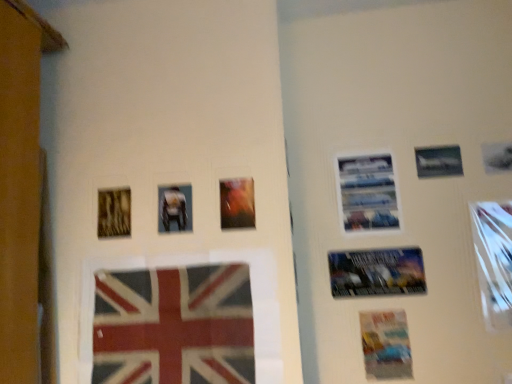
How much space does wooden textured frame at left, arranged as the 6th picture frame when viewed from the right, occupy vertically?

The height of wooden textured frame at left, arranged as the 6th picture frame when viewed from the right, is 6.43 inches.

Describe the element at coordinates (377, 272) in the screenshot. This screenshot has width=512, height=384. I see `metallic silver poster at center right, the 2th poster when ordered from bottom to top` at that location.

Locate an element on the screen. matte paper poster at lower right, the first poster when ordered from bottom to top is located at coordinates (386, 345).

Which is correct: metallic silver airplane at upper right, acting as the 4th picture frame starting from the left, is inside matte plastic picture frame at center, which is the fourth picture frame in right-to-left order, or outside of it?

metallic silver airplane at upper right, acting as the 4th picture frame starting from the left, lies outside matte plastic picture frame at center, which is the fourth picture frame in right-to-left order.

Locate an element on the screen. picture frame that is the 4th one below the metallic silver airplane at upper right, acting as the 4th picture frame starting from the left (from a real-world perspective) is located at coordinates (237, 203).

What's the angular difference between metallic silver airplane at upper right, marked as the 3th picture frame in a right-to-left arrangement, and matte plastic picture frame at center, which is the fourth picture frame in right-to-left order,'s facing directions?

0.828 degrees separate the facing orientations of metallic silver airplane at upper right, marked as the 3th picture frame in a right-to-left arrangement, and matte plastic picture frame at center, which is the fourth picture frame in right-to-left order.

Considering the relative positions of metallic silver airplane at upper right, acting as the 4th picture frame starting from the left, and matte plastic picture frame at center, the third picture frame viewed from the left, in the image provided, is metallic silver airplane at upper right, acting as the 4th picture frame starting from the left, to the right of matte plastic picture frame at center, the third picture frame viewed from the left, from the viewer's perspective?

Yes, metallic silver airplane at upper right, acting as the 4th picture frame starting from the left, is to the right of matte plastic picture frame at center, the third picture frame viewed from the left.

Is matte paper poster at lower right, marked as the third poster in a top-to-bottom arrangement, positioned beyond the bounds of matte plastic photo frame at center, which is the 5th picture frame in right-to-left order?

Yes, matte paper poster at lower right, marked as the third poster in a top-to-bottom arrangement, is located beyond the bounds of matte plastic photo frame at center, which is the 5th picture frame in right-to-left order.

You are a GUI agent. You are given a task and a screenshot of the screen. Output one action in this format:
    pyautogui.click(x=<x>, y=<y>)
    Task: Click on the 2nd poster positioned below the matte plastic photo frame at center, which is the 5th picture frame in right-to-left order (from a real-world perspective)
    This screenshot has width=512, height=384.
    Given the screenshot: What is the action you would take?
    pyautogui.click(x=386, y=345)

What's the angular difference between matte paper poster at lower right, the first poster when ordered from bottom to top, and matte plastic photo frame at center, which is the second picture frame in left-to-right order,'s facing directions?

1.34 degrees.

From the image's perspective, would you say matte paper poster at lower right, the first poster when ordered from bottom to top, is shown under matte plastic photo frame at center, which is the 5th picture frame in right-to-left order?

Yes, from the image's perspective, matte paper poster at lower right, the first poster when ordered from bottom to top, is beneath matte plastic photo frame at center, which is the 5th picture frame in right-to-left order.

Is textured fabric flag at lower center positioned with its back to metallic silver poster at upper right, the first poster positioned from the top?

No, metallic silver poster at upper right, the first poster positioned from the top, is not at the back of textured fabric flag at lower center.

From a real-world perspective, which object stands above the other?

metallic silver poster at upper right, the first poster positioned from the top.

From the picture: Can you tell me how much textured fabric flag at lower center and metallic silver poster at upper right, the first poster positioned from the top, differ in facing direction?

0.677 degrees separate the facing orientations of textured fabric flag at lower center and metallic silver poster at upper right, the first poster positioned from the top.

Is textured fabric flag at lower center to the right of metallic silver poster at upper right, marked as the third poster in a bottom-to-top arrangement, from the viewer's perspective?

In fact, textured fabric flag at lower center is to the left of metallic silver poster at upper right, marked as the third poster in a bottom-to-top arrangement.

Can you confirm if metallic silver poster at upper right, marked as the third poster in a bottom-to-top arrangement, is taller than textured fabric flag at lower center?

In fact, metallic silver poster at upper right, marked as the third poster in a bottom-to-top arrangement, may be shorter than textured fabric flag at lower center.

Consider the image. Can you confirm if metallic silver poster at upper right, the first poster positioned from the top, is smaller than textured fabric flag at lower center?

Yes, metallic silver poster at upper right, the first poster positioned from the top, is smaller than textured fabric flag at lower center.

Which is more distant, (375,174) or (217,320)?

Point (375,174)

In the image, is metallic silver poster at upper right, marked as the third poster in a bottom-to-top arrangement, on the left side or the right side of textured fabric flag at lower center?

Clearly, metallic silver poster at upper right, marked as the third poster in a bottom-to-top arrangement, is on the right of textured fabric flag at lower center in the image.

Based on the photo, could you tell me if metallic silver picture frame at right, placed as the first picture frame when sorted from right to left, is facing matte paper poster at lower right, marked as the third poster in a top-to-bottom arrangement?

No, metallic silver picture frame at right, placed as the first picture frame when sorted from right to left, is not aimed at matte paper poster at lower right, marked as the third poster in a top-to-bottom arrangement.

There is a metallic silver picture frame at right, placed as the first picture frame when sorted from right to left. At what (x,y) coordinates should I click in order to perform the action: click on the 2nd poster below it (from the image's perspective). Please return your answer as a coordinate pair (x, y). The width and height of the screenshot is (512, 384). Looking at the image, I should click on (386, 345).

From the image's perspective, which object appears higher, metallic silver picture frame at right, which appears as the sixth picture frame when viewed from the left, or matte paper poster at lower right, marked as the third poster in a top-to-bottom arrangement?

metallic silver picture frame at right, which appears as the sixth picture frame when viewed from the left, from the image's perspective.

From a real-world perspective, which is physically below, metallic silver picture frame at right, which appears as the sixth picture frame when viewed from the left, or matte paper poster at lower right, the first poster when ordered from bottom to top?

matte paper poster at lower right, the first poster when ordered from bottom to top, from a real-world perspective.

Is metallic silver poster at center right, which appears as the 2th poster when viewed from the top, thinner than metallic silver poster at upper right, marked as the third poster in a bottom-to-top arrangement?

No, metallic silver poster at center right, which appears as the 2th poster when viewed from the top, is not thinner than metallic silver poster at upper right, marked as the third poster in a bottom-to-top arrangement.

From the image's perspective, is metallic silver poster at center right, the 2th poster when ordered from bottom to top, below metallic silver poster at upper right, marked as the third poster in a bottom-to-top arrangement?

Indeed, from the image's perspective, metallic silver poster at center right, the 2th poster when ordered from bottom to top, is shown beneath metallic silver poster at upper right, marked as the third poster in a bottom-to-top arrangement.

Considering their positions, is metallic silver poster at center right, the 2th poster when ordered from bottom to top, located in front of or behind metallic silver poster at upper right, marked as the third poster in a bottom-to-top arrangement?

metallic silver poster at center right, the 2th poster when ordered from bottom to top, is positioned closer to the viewer than metallic silver poster at upper right, marked as the third poster in a bottom-to-top arrangement.

Is point (415, 258) positioned before point (350, 174)?

Yes, it is in front of point (350, 174).

From the picture: From the image's perspective, is textured fabric flag at lower center positioned above or below wooden textured frame at left, marked as the first picture frame in a left-to-right arrangement?

Based on their image positions, textured fabric flag at lower center is located beneath wooden textured frame at left, marked as the first picture frame in a left-to-right arrangement.

Consider the image. Which object is closer to the camera taking this photo, textured fabric flag at lower center or wooden textured frame at left, arranged as the 6th picture frame when viewed from the right?

textured fabric flag at lower center is in front.

Is textured fabric flag at lower center turned away from wooden textured frame at left, arranged as the 6th picture frame when viewed from the right?

No.

From the image's perspective, which picture frame is the 1st one below the metallic silver airplane at upper right, acting as the 4th picture frame starting from the left? Please provide its 2D coordinates.

[(237, 203)]

Locate an element on the screen. This screenshot has height=384, width=512. the 1st poster behind the matte plastic photo frame at center, which is the 5th picture frame in right-to-left order, starting your count from the anchor is located at coordinates (386, 345).

Estimate the real-world distances between objects in this image. Which object is closer to metallic silver airplane at upper right, positioned as the 5th picture frame in left-to-right order, matte plastic picture frame at center, which is the fourth picture frame in right-to-left order, or metallic silver poster at center right, which appears as the 2th poster when viewed from the top?

Among the two, metallic silver poster at center right, which appears as the 2th poster when viewed from the top, is located nearer to metallic silver airplane at upper right, positioned as the 5th picture frame in left-to-right order.

Considering their positions, is matte plastic picture frame at center, the third picture frame viewed from the left, positioned further to metallic silver picture frame at right, placed as the first picture frame when sorted from right to left, than metallic silver poster at upper right, marked as the third poster in a bottom-to-top arrangement?

matte plastic picture frame at center, the third picture frame viewed from the left, is further to metallic silver picture frame at right, placed as the first picture frame when sorted from right to left.

Based on their spatial positions, is matte plastic photo frame at center, which is the second picture frame in left-to-right order, or wooden textured frame at left, marked as the first picture frame in a left-to-right arrangement, further from metallic silver poster at upper right, the first poster positioned from the top?

wooden textured frame at left, marked as the first picture frame in a left-to-right arrangement, lies further to metallic silver poster at upper right, the first poster positioned from the top, than the other object.

Looking at the image, which one is located closer to metallic silver poster at center right, which appears as the 2th poster when viewed from the top, matte paper poster at lower right, the first poster when ordered from bottom to top, or matte plastic picture frame at center, which is the fourth picture frame in right-to-left order?

Based on the image, matte paper poster at lower right, the first poster when ordered from bottom to top, appears to be nearer to metallic silver poster at center right, which appears as the 2th poster when viewed from the top.

Looking at this image, from the image, which object appears to be nearer to metallic silver airplane at upper right, marked as the 3th picture frame in a right-to-left arrangement, metallic silver picture frame at right, which appears as the sixth picture frame when viewed from the left, or metallic silver poster at center right, the 2th poster when ordered from bottom to top?

The object closer to metallic silver airplane at upper right, marked as the 3th picture frame in a right-to-left arrangement, is metallic silver picture frame at right, which appears as the sixth picture frame when viewed from the left.

Which object lies further to the anchor point textured fabric flag at lower center, matte paper poster at lower right, the first poster when ordered from bottom to top, or wooden textured frame at left, marked as the first picture frame in a left-to-right arrangement?

matte paper poster at lower right, the first poster when ordered from bottom to top.

Which object lies further to the anchor point matte paper poster at lower right, marked as the third poster in a top-to-bottom arrangement, matte plastic photo frame at center, which is the second picture frame in left-to-right order, or textured fabric flag at lower center?

Based on the image, matte plastic photo frame at center, which is the second picture frame in left-to-right order, appears to be further to matte paper poster at lower right, marked as the third poster in a top-to-bottom arrangement.

Estimate the real-world distances between objects in this image. Which object is closer to matte plastic picture frame at center, the third picture frame viewed from the left, metallic silver poster at upper right, marked as the third poster in a bottom-to-top arrangement, or textured fabric flag at lower center?

textured fabric flag at lower center lies closer to matte plastic picture frame at center, the third picture frame viewed from the left, than the other object.

At what (x,y) coordinates should I click in order to perform the action: click on picture frame between metallic silver poster at upper right, the first poster positioned from the top, and metallic silver airplane at upper right, acting as the 2th picture frame starting from the right, in the horizontal direction. Please return your answer as a coordinate pair (x, y). The width and height of the screenshot is (512, 384). Looking at the image, I should click on (438, 161).

This screenshot has height=384, width=512. What are the coordinates of `flag located between wooden textured frame at left, arranged as the 6th picture frame when viewed from the right, and metallic silver airplane at upper right, acting as the 2th picture frame starting from the right, in the left-right direction` in the screenshot? It's located at (174, 326).

Locate an element on the screen. The width and height of the screenshot is (512, 384). poster between wooden textured frame at left, marked as the first picture frame in a left-to-right arrangement, and metallic silver poster at center right, the 2th poster when ordered from bottom to top, in the horizontal direction is located at coordinates (368, 192).

In order to click on poster between matte plastic photo frame at center, which is the 5th picture frame in right-to-left order, and metallic silver poster at center right, which appears as the 2th poster when viewed from the top, from left to right in this screenshot , I will do `click(368, 192)`.